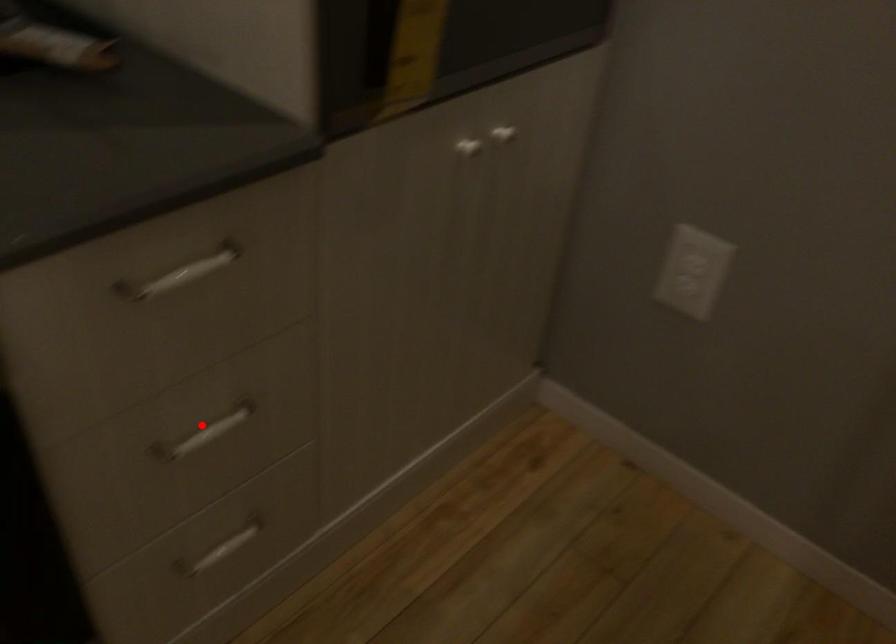
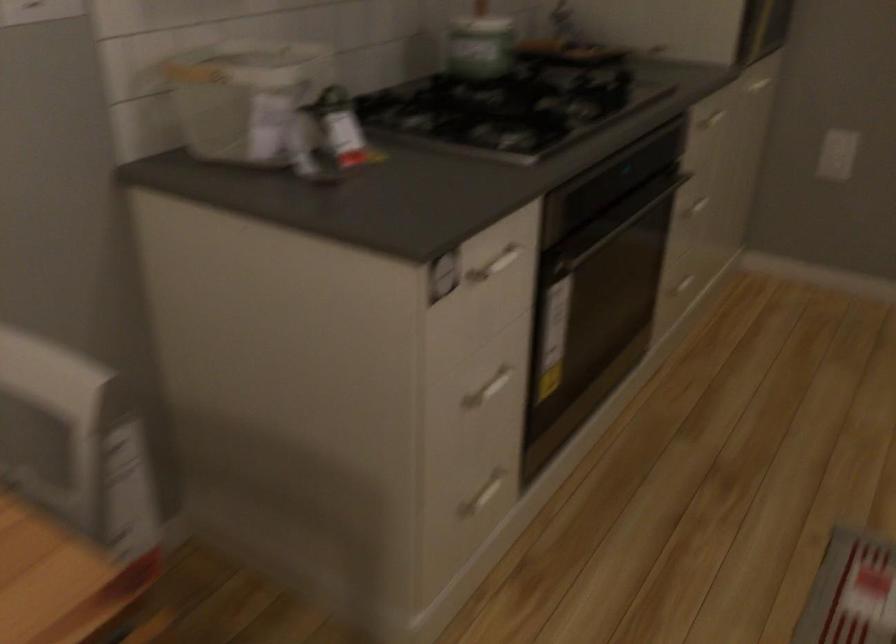
Find the pixel in the second image that matches the highlighted location in the first image.

(694, 204)